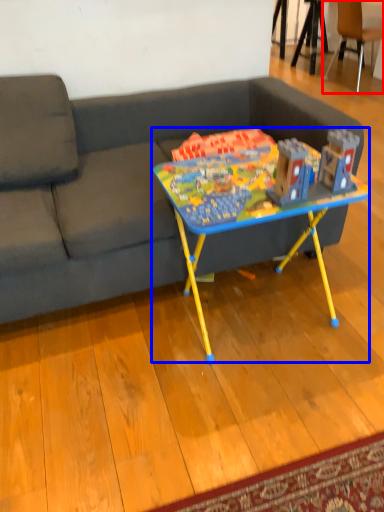
Question: Which object appears farthest to the camera in this image, chair (highlighted by a red box) or table (highlighted by a blue box)?

Choices:
 (A) chair
 (B) table

Answer: (A)